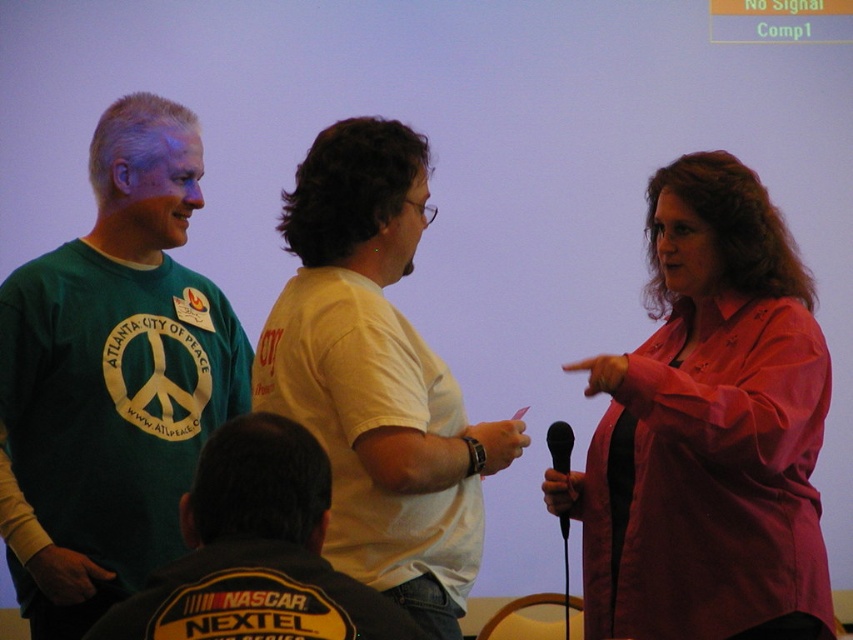
Question: Estimate the real-world distances between objects in this image. Which object is closer to the dark gray fabric shirt at center?

Choices:
 (A) white matte t-shirt at center
 (B) pink satin blouse at right

Answer: (A)

Question: Is green matte t-shirt at left closer to the viewer compared to white matte t-shirt at center?

Choices:
 (A) yes
 (B) no

Answer: (B)

Question: Which of the following is the closest to the observer?

Choices:
 (A) click(199, 490)
 (B) click(155, 259)
 (C) click(778, 225)

Answer: (A)

Question: Does green matte t-shirt at left have a lesser width compared to dark gray fabric shirt at center?

Choices:
 (A) yes
 (B) no

Answer: (B)

Question: Can you confirm if white matte t-shirt at center is thinner than dark gray fabric shirt at center?

Choices:
 (A) no
 (B) yes

Answer: (A)

Question: Which point appears closest to the camera in this image?

Choices:
 (A) (198, 632)
 (B) (556, 512)
 (C) (692, 300)

Answer: (A)